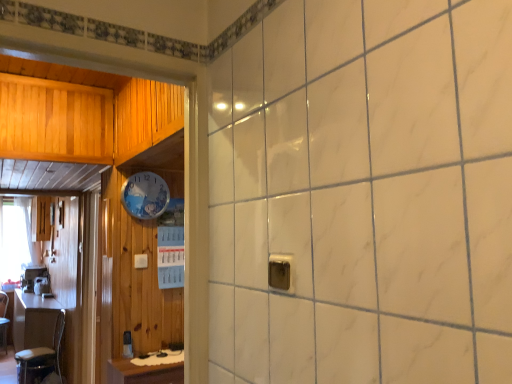
Question: Is metallic silver outlet at center in front of white glossy clock at upper center?

Choices:
 (A) yes
 (B) no

Answer: (A)

Question: Is metallic silver outlet at center shorter than white glossy clock at upper center?

Choices:
 (A) no
 (B) yes

Answer: (B)

Question: From the image's perspective, is metallic silver outlet at center located beneath white glossy clock at upper center?

Choices:
 (A) no
 (B) yes

Answer: (B)

Question: Is metallic silver outlet at center to the right of white glossy clock at upper center from the viewer's perspective?

Choices:
 (A) no
 (B) yes

Answer: (B)

Question: Does metallic silver outlet at center have a larger size compared to white glossy clock at upper center?

Choices:
 (A) yes
 (B) no

Answer: (B)

Question: Does metallic silver outlet at center have a smaller size compared to white glossy clock at upper center?

Choices:
 (A) no
 (B) yes

Answer: (B)

Question: Considering the relative sizes of wooden table at left and white sheer curtain at left in the image provided, is wooden table at left thinner than white sheer curtain at left?

Choices:
 (A) no
 (B) yes

Answer: (A)

Question: Is wooden table at left directly adjacent to white sheer curtain at left?

Choices:
 (A) no
 (B) yes

Answer: (A)

Question: Is white sheer curtain at left located within wooden table at left?

Choices:
 (A) yes
 (B) no

Answer: (B)

Question: From a real-world perspective, is wooden table at left positioned over white sheer curtain at left based on gravity?

Choices:
 (A) yes
 (B) no

Answer: (B)

Question: Does wooden table at left appear on the left side of white sheer curtain at left?

Choices:
 (A) yes
 (B) no

Answer: (B)

Question: Does wooden table at left have a greater height compared to white sheer curtain at left?

Choices:
 (A) yes
 (B) no

Answer: (B)

Question: Is wooden table at left to the right of metallic silver chair at left from the viewer's perspective?

Choices:
 (A) no
 (B) yes

Answer: (B)